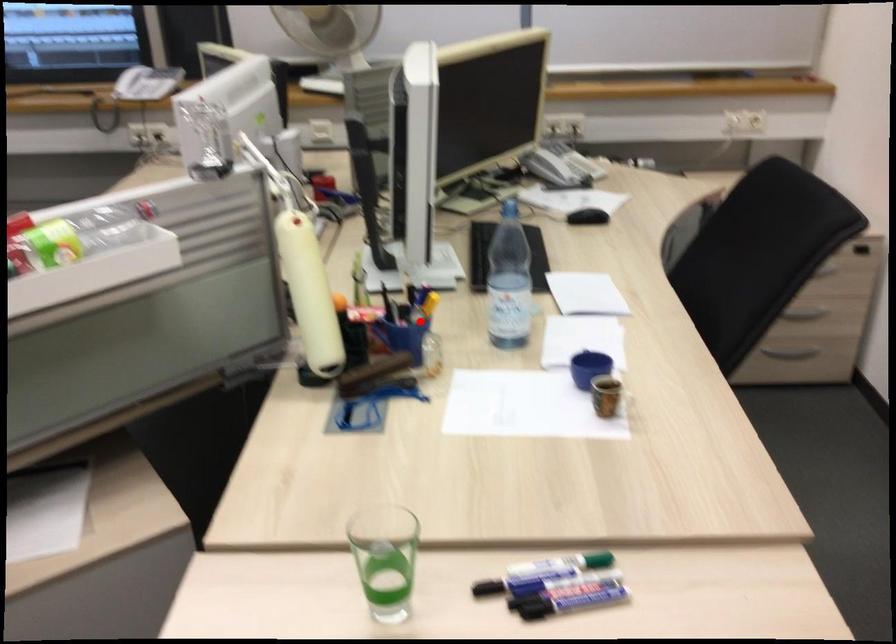
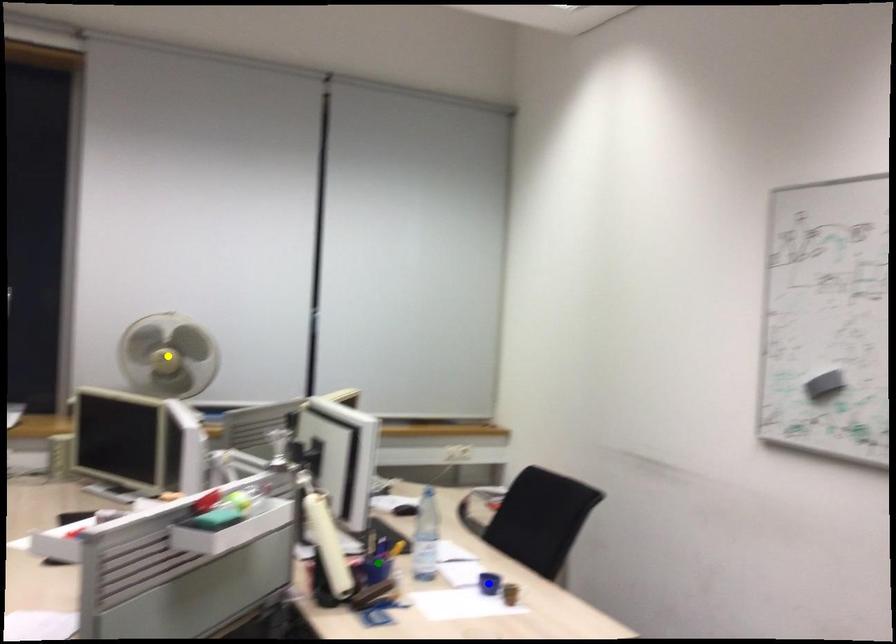
Question: I am providing you with two images of the same scene from different viewpoints. A red point is marked on the first image. You are given multiple points on the second image. In image 2, which mark is for the same physical point as the one in image 1?

Choices:
 (A) green point
 (B) blue point
 (C) yellow point

Answer: (A)